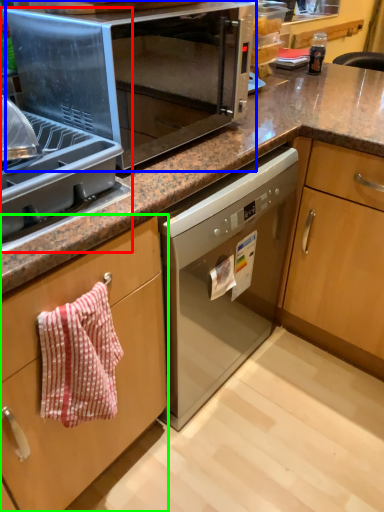
Question: Estimate the real-world distances between objects in this image. Which object is farther from appliance (highlighted by a red box), microwave oven (highlighted by a blue box) or cabinetry (highlighted by a green box)?

Choices:
 (A) microwave oven
 (B) cabinetry

Answer: (B)